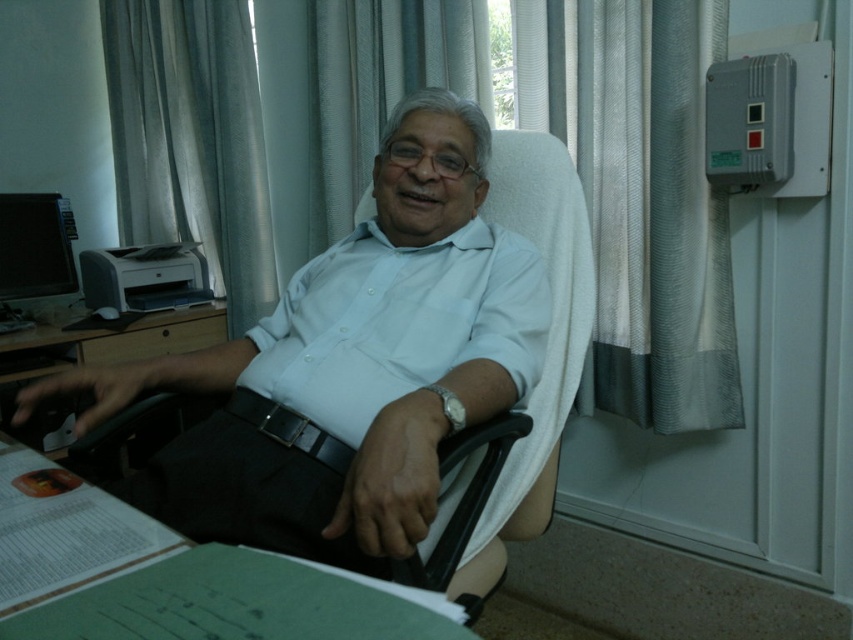
You are a photographer adjusting the focus on your camera. You notice two points in the image at coordinates point (413, 336) and point (495, 508). Which point should you focus on to ensure the foreground is sharp?

Point (413, 336) is closer to the camera than point (495, 508), so focusing on point (413, 336) will ensure the foreground is sharp.

You are a delivery person who needs to place a small package between the white smooth shirt at center and the black plastic swivel chair at center. Is there enough space for the package?

The distance between the white smooth shirt at center and the black plastic swivel chair at center is 8.63 inches. If the package is smaller than this distance, it should fit.

You are a delivery person who needs to place a package on the desk. The package is 1 meter tall. Can you place it on the black plastic computer desk at lower left without it hitting the gray fabric curtain at upper left?

The gray fabric curtain at upper left is located above the black plastic computer desk at lower left. Since the package is 1 meter tall, it may hit the curtain if placed on the desk. Check the vertical clearance between the desk and the curtain before placing the package.